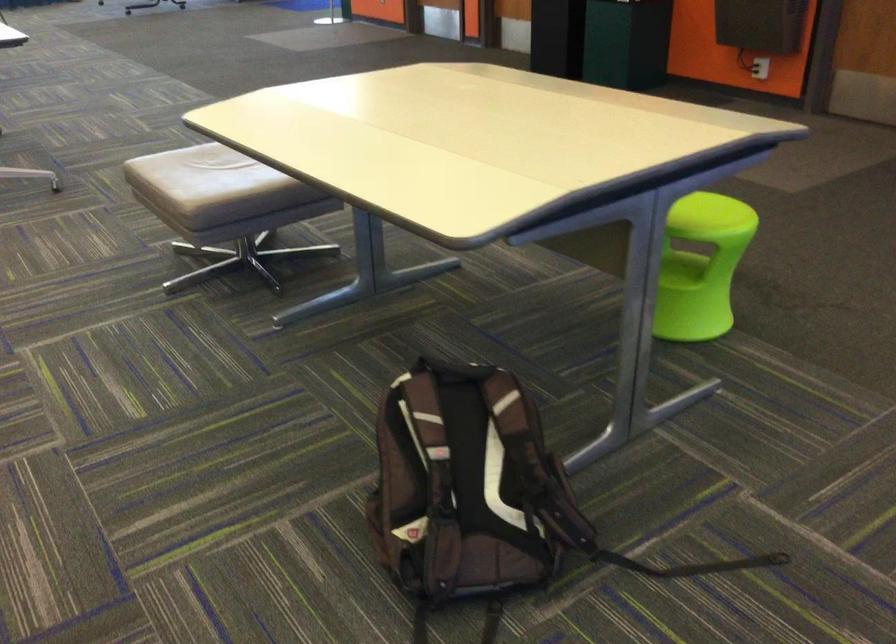
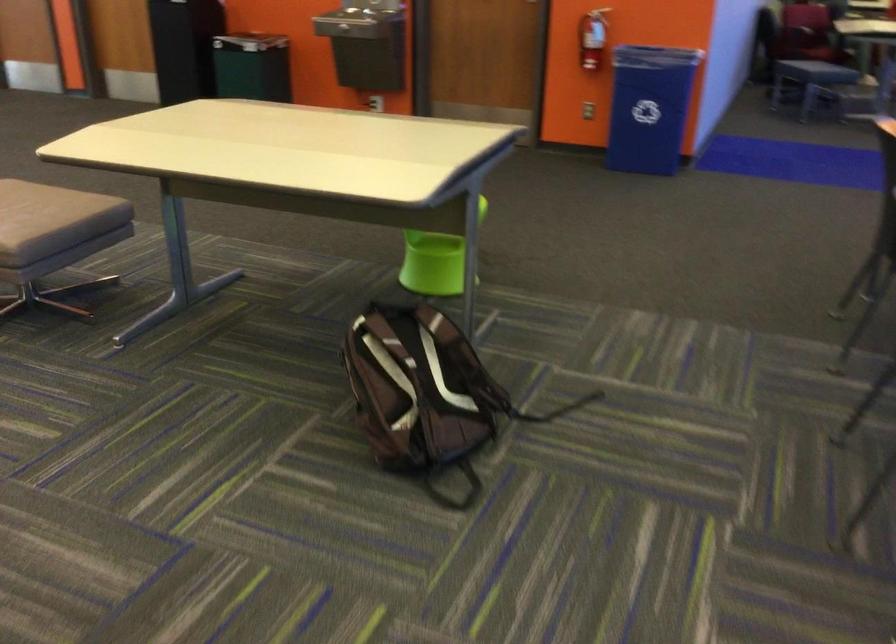
Where in the second image is the point corresponding to the point at 658,295 from the first image?

(435, 261)